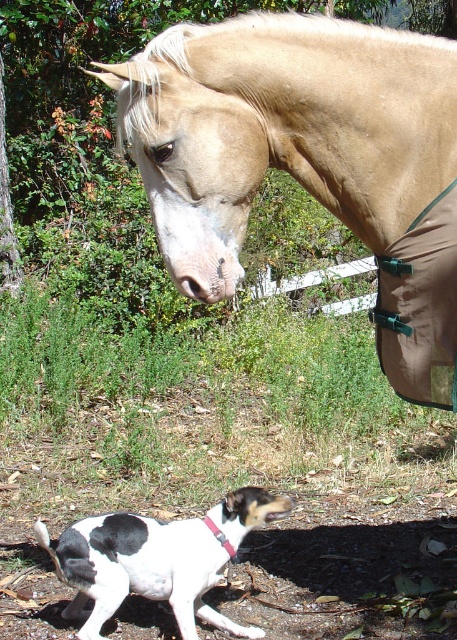
You are a photographer trying to capture both the light brown horse at upper center and the black and white fur at lower left in the same frame. Based on their positions and sizes, do you think you can fit both into your camera viewfinder without moving your position?

The light brown horse at upper center might be wider than black and white fur at lower left, so there is a possibility that the horse could block the view of the black and white fur at lower left depending on their exact positions and the camera angle.

Based on the photo, you are standing at the point labeled point (400, 273) and want to walk to the point labeled point (35, 529). Which direction should you move relative to the other point?

You should move backward relative to the point labeled point (35, 529) because point (400, 273) is in front of it.